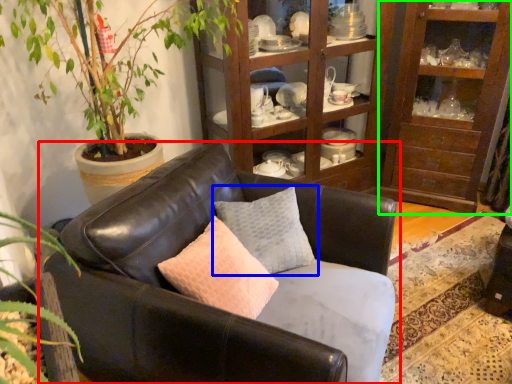
Question: Which object is the closest to the studio couch (highlighted by a red box)? Choose among these: pillow (highlighted by a blue box) or shelf (highlighted by a green box).

Choices:
 (A) pillow
 (B) shelf

Answer: (A)